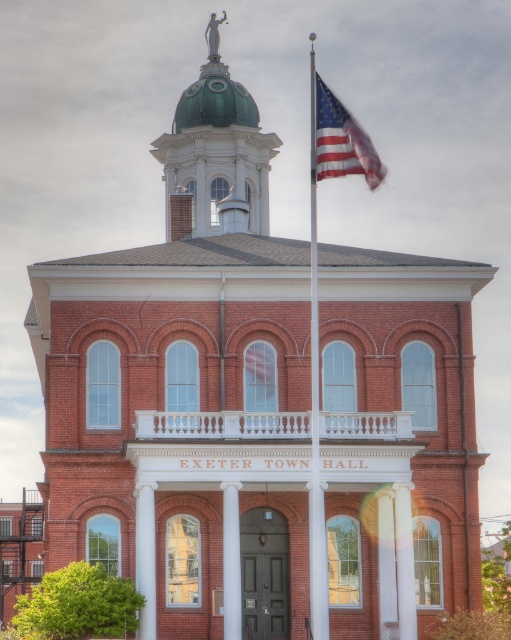
Consider the image. You are standing in front of the Exeter Town Hall and notice the metallic silver flag pole at center and the american flag at upper right. Which object is positioned higher up in the image?

The american flag at upper right is positioned higher up in the image than the metallic silver flag pole at center.

You are standing in front of the Exeter Town Hall and want to take a photo of the metallic silver flag pole at center. If your camera has a maximum focus range of 60 meters, will it be able to capture the flag pole clearly?

The metallic silver flag pole at center is 60.53 meters from camera, which exceeds the camera maximum focus range of 60 meters. Therefore, the camera cannot capture the flag pole clearly.

You are standing in front of the Exeter Town Hall. You notice the metallic silver flag pole at center and the american flag at upper right. Which object is bigger in size?

The metallic silver flag pole at center is larger in size compared to the american flag at upper right.